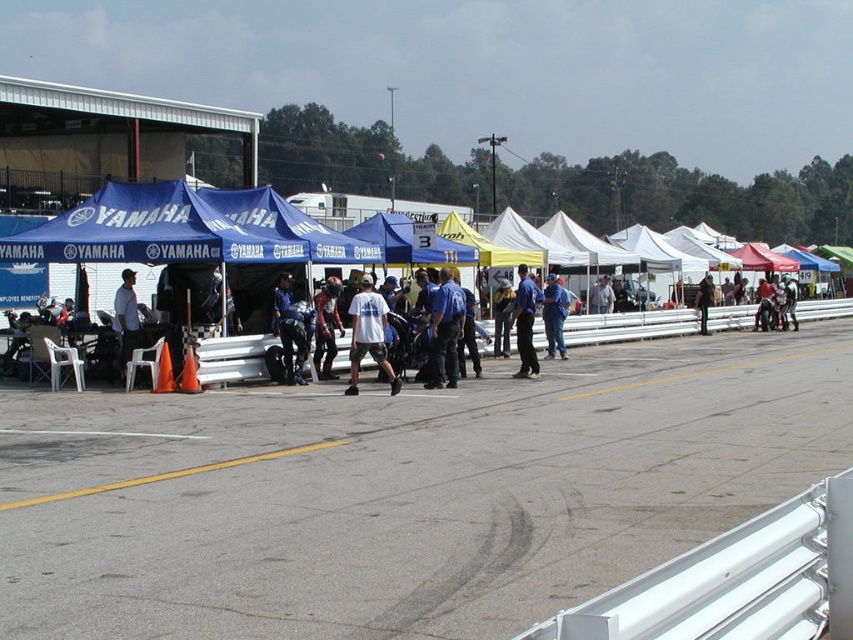
Who is more forward, (132,321) or (560,298)?

Point (132,321) is more forward.

Image resolution: width=853 pixels, height=640 pixels. I want to click on light blue shirt at center, so click(x=126, y=317).

Is blue uniform at center taller than blue fabric jacket at center?

Indeed, blue uniform at center has a greater height compared to blue fabric jacket at center.

How much distance is there between blue uniform at center and blue fabric jacket at center?

blue uniform at center is 3.46 meters away from blue fabric jacket at center.

The height and width of the screenshot is (640, 853). I want to click on blue uniform at center, so click(x=525, y=321).

Does white jersey at center have a smaller size compared to blue uniform at center?

Actually, white jersey at center might be larger than blue uniform at center.

Who is positioned more to the right, white jersey at center or blue uniform at center?

From the viewer's perspective, blue uniform at center appears more on the right side.

Where is `white jersey at center`? white jersey at center is located at coordinates (326, 326).